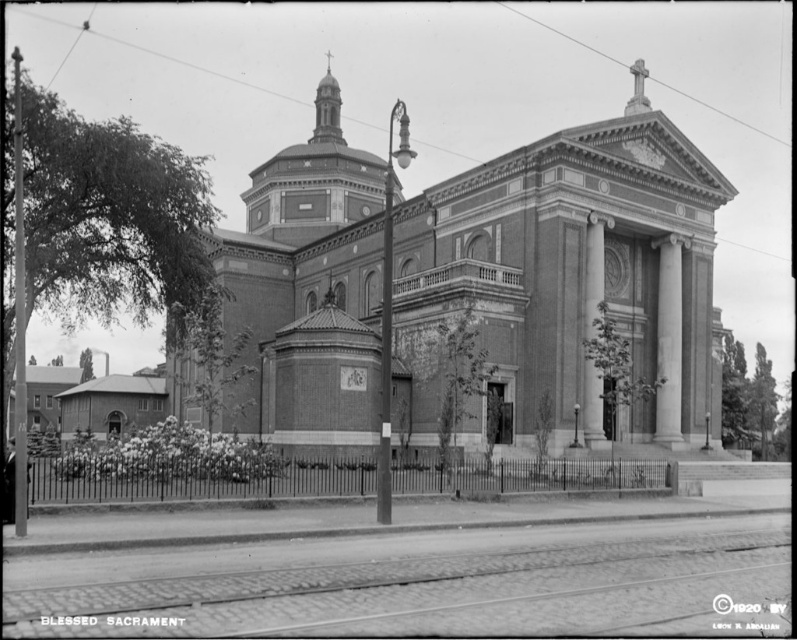
You are standing in a park and see the brick church at center in the distance. If you want to take a photo of it from the front, where should you position yourself relative to the church?

To take a photo of the brick church at center from the front, you should position yourself directly in front of it, facing the main entrance which is centrally located on the facade.

You are standing in front of the church and notice two columns at the center. Which column is closer to you, the white marble column at center or the smooth stone column at center?

The white marble column at center is closer to you because it is further to the viewer than the smooth stone column at center.